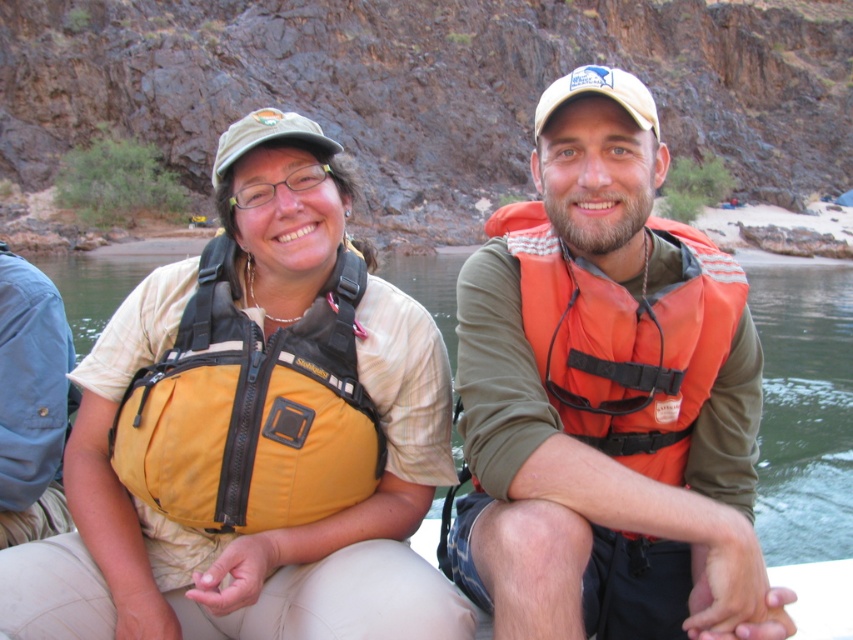
Can you confirm if orange life vest at center is positioned above orange fabric life jacket at center?

No, orange life vest at center is not above orange fabric life jacket at center.

Which is behind, point (532, 394) or point (595, 429)?

Point (595, 429)

Where is `orange life vest at center`? This screenshot has width=853, height=640. orange life vest at center is located at coordinates (607, 396).

Can you confirm if orange life vest at center is wider than yellow fabric life vest at left?

No.

Between point (585, 253) and point (804, 385), which one is positioned behind?

Positioned behind is point (804, 385).

You are a GUI agent. You are given a task and a screenshot of the screen. Output one action in this format:
    pyautogui.click(x=<x>, y=<y>)
    Task: Click on the orange life vest at center
    The height and width of the screenshot is (640, 853).
    Given the screenshot: What is the action you would take?
    pyautogui.click(x=607, y=396)

Based on the photo, does orange life vest at center have a larger size compared to yellow fabric life jacket at left?

Indeed, orange life vest at center has a larger size compared to yellow fabric life jacket at left.

Is orange life vest at center above yellow fabric life jacket at left?

Yes.

At what (x,y) coordinates should I click in order to perform the action: click on orange life vest at center. Please return your answer as a coordinate pair (x, y). The height and width of the screenshot is (640, 853). Looking at the image, I should click on (607, 396).